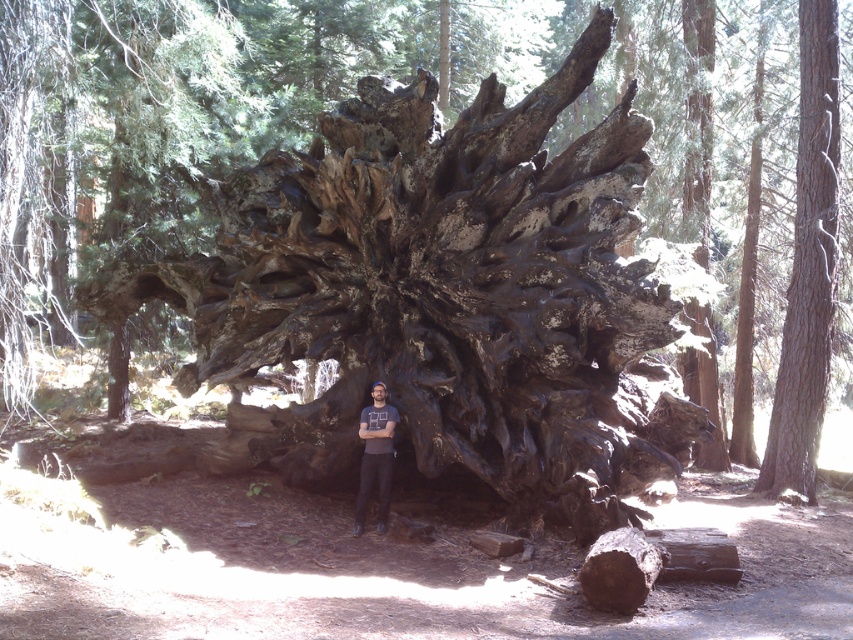
Question: Which point is farther to the camera?

Choices:
 (A) smooth brown bark at right
 (B) dark gray t-shirt at center

Answer: (A)

Question: Which point is farther to the camera?

Choices:
 (A) (374, 392)
 (B) (828, 38)

Answer: (B)

Question: Does smooth brown bark at right come in front of dark gray t-shirt at center?

Choices:
 (A) yes
 (B) no

Answer: (B)

Question: Which point is farther to the camera?

Choices:
 (A) dark gray t-shirt at center
 (B) smooth brown bark at right

Answer: (B)

Question: From the image, what is the correct spatial relationship of smooth brown bark at right in relation to dark gray t-shirt at center?

Choices:
 (A) below
 (B) above

Answer: (B)

Question: Is smooth brown bark at right below dark gray t-shirt at center?

Choices:
 (A) no
 (B) yes

Answer: (A)